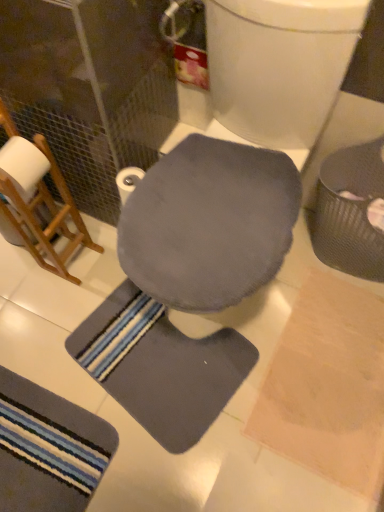
Question: In which direction should I rotate to look at gray soft mat at center, which is the second bath mat from left to right?

Choices:
 (A) right
 (B) left

Answer: (B)

Question: Is matte gray swivel chair at center completely or partially inside striped fabric bath mat at lower left, acting as the first bath mat starting from the left?

Choices:
 (A) yes
 (B) no

Answer: (B)

Question: Is striped fabric bath mat at lower left, acting as the first bath mat starting from the left, outside matte gray swivel chair at center?

Choices:
 (A) no
 (B) yes

Answer: (B)

Question: Does striped fabric bath mat at lower left, positioned as the second bath mat in right-to-left order, turn towards matte gray swivel chair at center?

Choices:
 (A) yes
 (B) no

Answer: (B)

Question: Are striped fabric bath mat at lower left, acting as the first bath mat starting from the left, and matte gray swivel chair at center making contact?

Choices:
 (A) yes
 (B) no

Answer: (B)

Question: Is the position of striped fabric bath mat at lower left, positioned as the second bath mat in right-to-left order, more distant than that of matte gray swivel chair at center?

Choices:
 (A) no
 (B) yes

Answer: (B)

Question: From the image's perspective, is striped fabric bath mat at lower left, positioned as the second bath mat in right-to-left order, under matte gray swivel chair at center?

Choices:
 (A) yes
 (B) no

Answer: (A)

Question: Is white matte toilet paper at center bigger than striped fabric bath mat at lower left, positioned as the second bath mat in right-to-left order?

Choices:
 (A) yes
 (B) no

Answer: (B)

Question: Is white matte toilet paper at center far away from striped fabric bath mat at lower left, positioned as the second bath mat in right-to-left order?

Choices:
 (A) yes
 (B) no

Answer: (B)

Question: From the image's perspective, is white matte toilet paper at center on top of striped fabric bath mat at lower left, positioned as the second bath mat in right-to-left order?

Choices:
 (A) no
 (B) yes

Answer: (B)

Question: Is white matte toilet paper at center looking in the opposite direction of striped fabric bath mat at lower left, acting as the first bath mat starting from the left?

Choices:
 (A) no
 (B) yes

Answer: (A)

Question: Considering the relative positions of white matte toilet paper at center and striped fabric bath mat at lower left, positioned as the second bath mat in right-to-left order, in the image provided, is white matte toilet paper at center to the right of striped fabric bath mat at lower left, positioned as the second bath mat in right-to-left order, from the viewer's perspective?

Choices:
 (A) no
 (B) yes

Answer: (B)

Question: Can you confirm if white matte toilet paper at center is thinner than striped fabric bath mat at lower left, acting as the first bath mat starting from the left?

Choices:
 (A) yes
 (B) no

Answer: (A)

Question: Can you confirm if striped fabric bath mat at lower left, acting as the first bath mat starting from the left, is positioned to the left of metallic textured trash can at right?

Choices:
 (A) no
 (B) yes

Answer: (B)